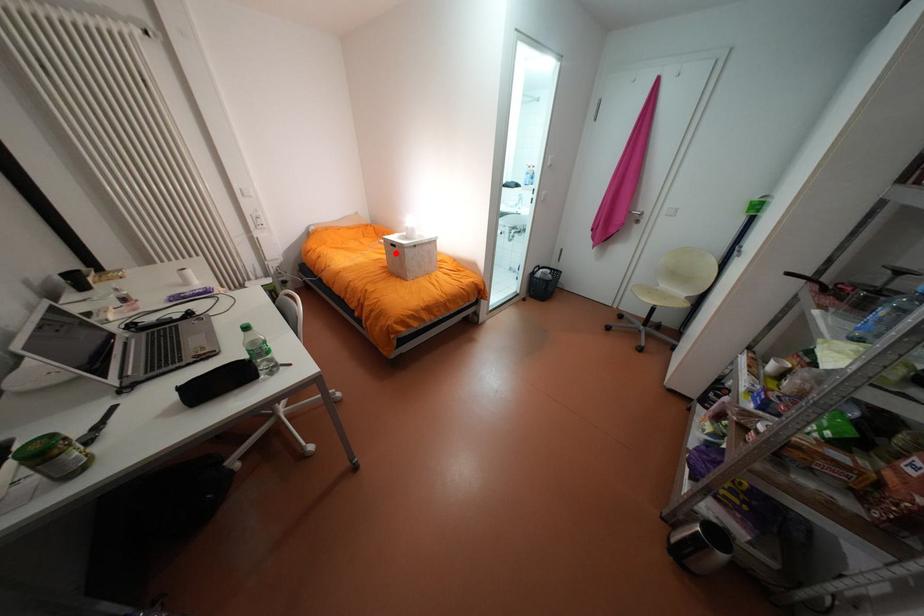
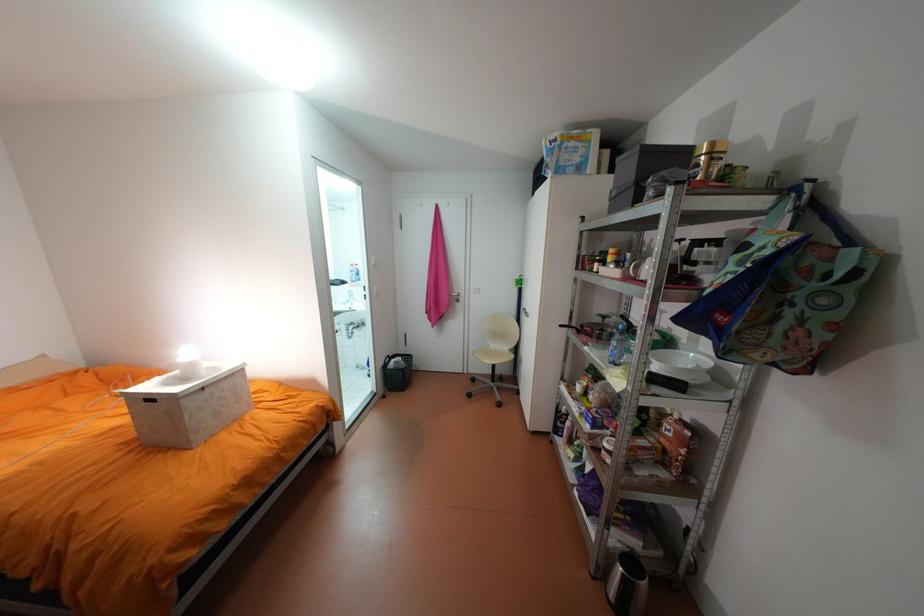
Find the pixel in the second image that matches the highlighted location in the first image.

(143, 411)